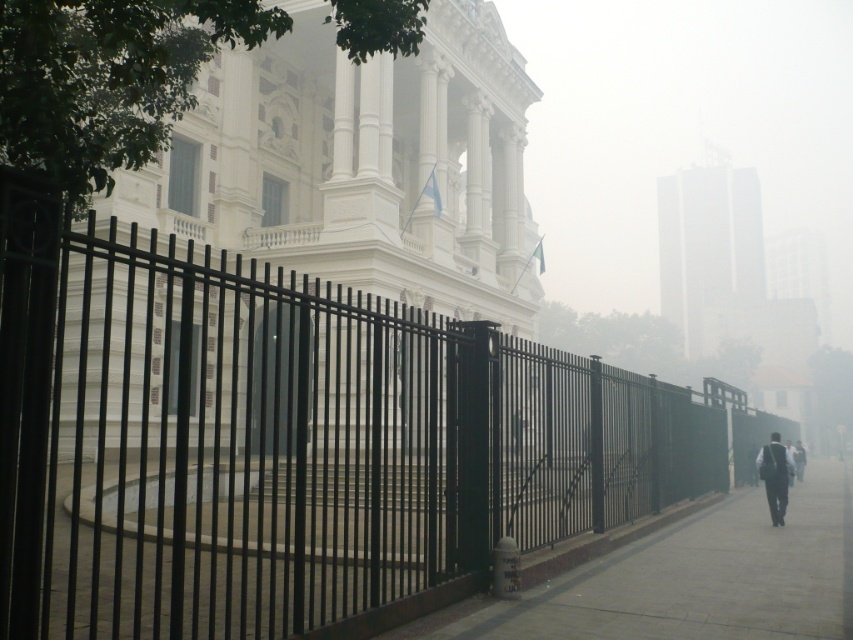
You are a delivery person with a cart that is 1.2 meters wide. You need to move from the black metal fence at center to the smooth concrete pavement at lower right. Is there enough space between them for your cart to pass through?

The distance between the black metal fence at center and the smooth concrete pavement at lower right is 7.17 meters. Since your cart is only 1.2 meters wide, there is ample space for it to pass through comfortably.

You are a delivery person approaching the building and need to park your vehicle on the smooth concrete pavement at lower right. Can you drive through the black metal fence at center to reach the pavement?

The black metal fence at center is positioned over smooth concrete pavement at lower right, meaning the fence is blocking access to the pavement. You cannot drive through the fence to reach the pavement.